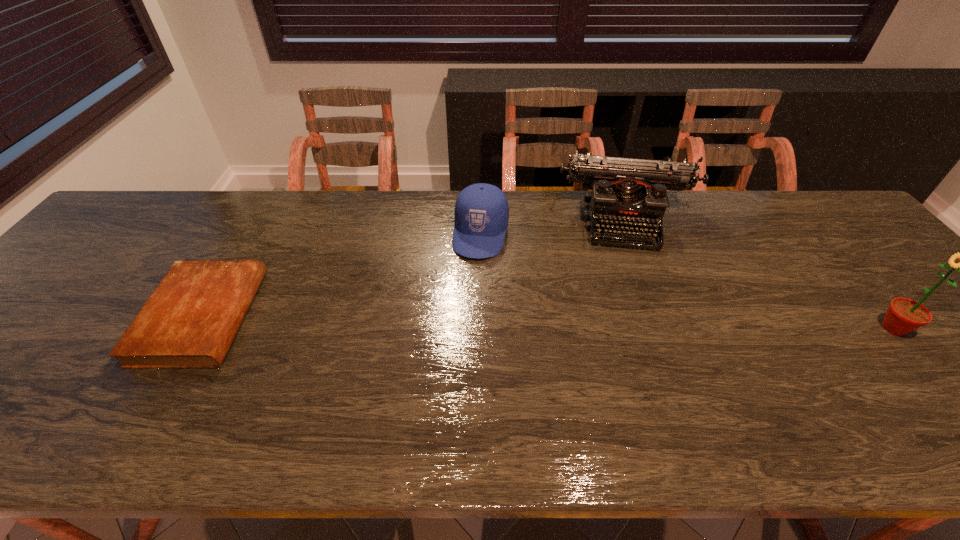
At what (x,y) coordinates should I click in order to perform the action: click on vacant region between the rightmost object and the cap. Please return your answer as a coordinate pair (x, y). The image size is (960, 540). Looking at the image, I should click on (686, 281).

This screenshot has width=960, height=540. Find the location of `free space between the tallest object and the shortest object`. free space between the tallest object and the shortest object is located at coordinates (548, 322).

Where is `free space between the third shortest object and the Bible`? The height and width of the screenshot is (540, 960). free space between the third shortest object and the Bible is located at coordinates (414, 267).

Find the location of `free space that is in between the tallest object and the shortest object`. free space that is in between the tallest object and the shortest object is located at coordinates (548, 322).

Where is `free space between the typewriter and the leftmost object`? The width and height of the screenshot is (960, 540). free space between the typewriter and the leftmost object is located at coordinates (414, 267).

The image size is (960, 540). I want to click on blank region between the typewriter and the third tallest object, so click(x=553, y=226).

In order to click on vacant space in between the rightmost object and the typewriter in this screenshot , I will do `click(759, 273)`.

Image resolution: width=960 pixels, height=540 pixels. I want to click on object that is the third closest one to the sunflower, so click(x=190, y=320).

Identify which object is located as the nearest to the typewriter. Please provide its 2D coordinates. Your answer should be formatted as a tuple, i.e. [(x, y)], where the tuple contains the x and y coordinates of a point satisfying the conditions above.

[(481, 215)]

In order to click on vacant area in the image that satisfies the following two spatial constraints: 1. on the front side of the rightmost object; 2. on the face of the third tallest object in this screenshot , I will do pos(481,328).